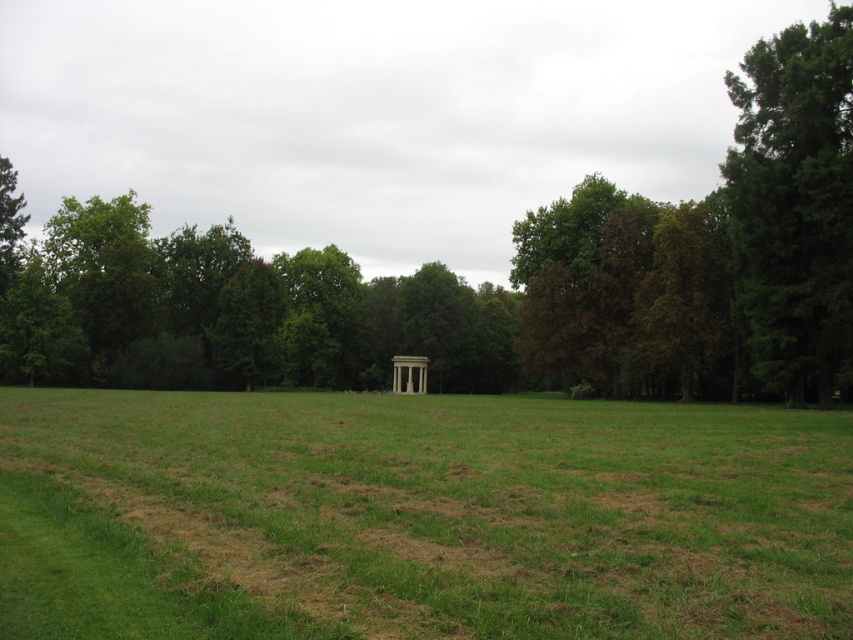
Question: From the image, what is the correct spatial relationship of green coniferous tree at right in relation to white marble gazebo at center?

Choices:
 (A) above
 (B) below

Answer: (A)

Question: Which point is farther to the camera?

Choices:
 (A) (792, 177)
 (B) (325, 451)
 (C) (402, 390)

Answer: (C)

Question: Does green grassy field at center appear on the left side of green coniferous tree at right?

Choices:
 (A) yes
 (B) no

Answer: (A)

Question: Which point is farther from the camera taking this photo?

Choices:
 (A) (392, 358)
 (B) (822, 108)
 (C) (735, 493)

Answer: (A)

Question: Is green grassy field at center behind green coniferous tree at right?

Choices:
 (A) no
 (B) yes

Answer: (A)

Question: Which point is farther from the camera taking this photo?

Choices:
 (A) (419, 385)
 (B) (822, 490)

Answer: (A)